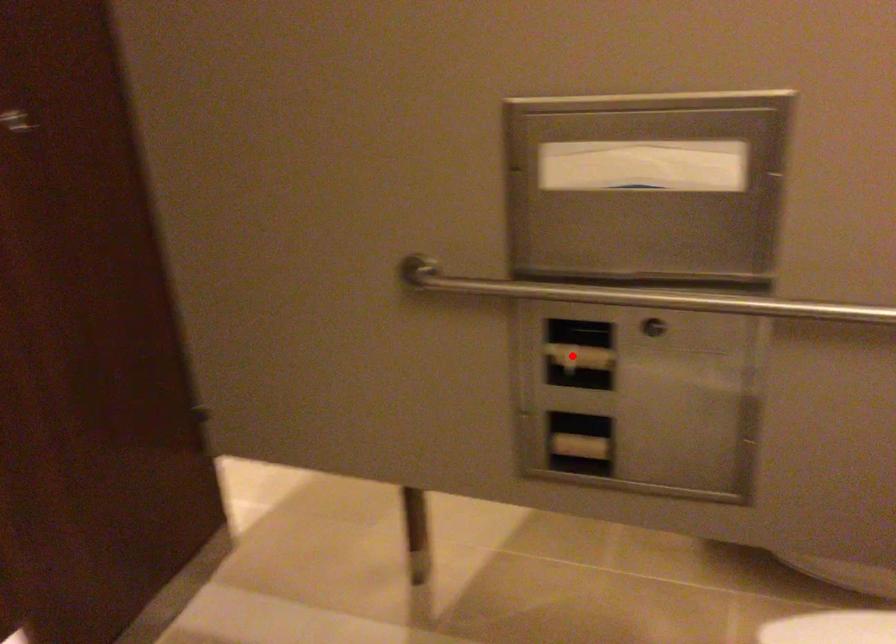
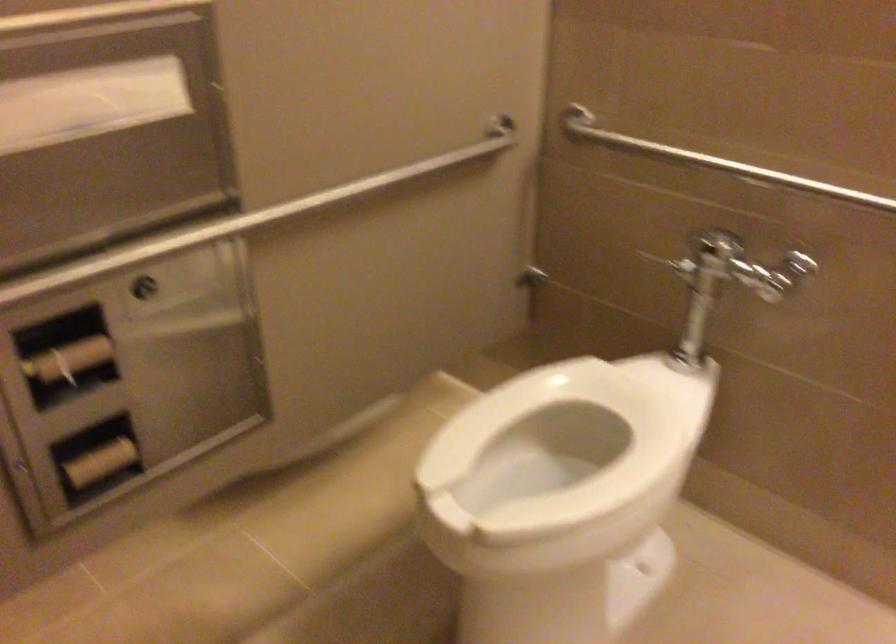
Question: I am providing you with two images of the same scene from different viewpoints. In image1, a red point is highlighted. Considering the same 3D point in image2, which of the following is correct?

Choices:
 (A) It is closer
 (B) It is farther

Answer: (A)